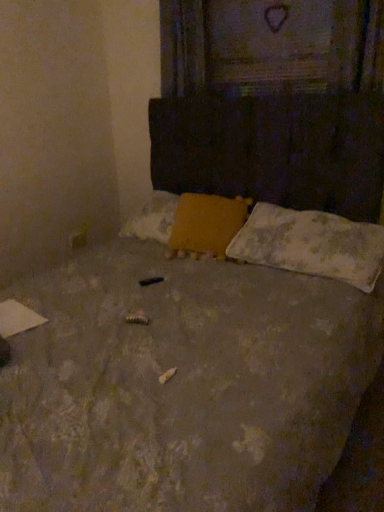
What do you see at coordinates (271, 45) in the screenshot?
I see `wooden textured frame at upper center` at bounding box center [271, 45].

Identify the location of yellow fabric pillow at center, which is counted as the second pillow, starting from the right. (206, 225).

How distant is wooden textured frame at upper center from yellow fabric pillow at center, acting as the 1th pillow starting from the left?

They are 39.28 inches apart.

Which object is closer to the camera taking this photo, wooden textured frame at upper center or yellow fabric pillow at center, acting as the 1th pillow starting from the left?

yellow fabric pillow at center, acting as the 1th pillow starting from the left.

In the scene shown: Does wooden textured frame at upper center touch yellow fabric pillow at center, acting as the 1th pillow starting from the left?

No, wooden textured frame at upper center is not beside yellow fabric pillow at center, acting as the 1th pillow starting from the left.

Which is more to the left, wooden textured frame at upper center or yellow fabric pillow at center, which is counted as the second pillow, starting from the right?

yellow fabric pillow at center, which is counted as the second pillow, starting from the right, is more to the left.

Measure the distance between white textured pillow at lower right, which ranks as the second pillow in left-to-right order, and yellow fabric pillow at center, acting as the 1th pillow starting from the left.

white textured pillow at lower right, which ranks as the second pillow in left-to-right order, and yellow fabric pillow at center, acting as the 1th pillow starting from the left, are 11.08 inches apart.

How different are the orientations of white textured pillow at lower right, which ranks as the second pillow in left-to-right order, and yellow fabric pillow at center, acting as the 1th pillow starting from the left, in degrees?

18.1 degrees.

Is white textured pillow at lower right, which ranks as the second pillow in left-to-right order, thinner than yellow fabric pillow at center, acting as the 1th pillow starting from the left?

Incorrect, the width of white textured pillow at lower right, which ranks as the second pillow in left-to-right order, is not less than that of yellow fabric pillow at center, acting as the 1th pillow starting from the left.

From the picture: Which of these two, white textured pillow at lower right, which ranks as the second pillow in left-to-right order, or yellow fabric pillow at center, acting as the 1th pillow starting from the left, is smaller?

yellow fabric pillow at center, acting as the 1th pillow starting from the left.

In the image, is wooden textured frame at upper center on the left side or the right side of white textured pillow at lower right, which ranks as the second pillow in left-to-right order?

Based on their positions, wooden textured frame at upper center is located to the left of white textured pillow at lower right, which ranks as the second pillow in left-to-right order.

Is wooden textured frame at upper center inside or outside of white textured pillow at lower right, the first pillow in the right-to-left sequence?

wooden textured frame at upper center lies outside white textured pillow at lower right, the first pillow in the right-to-left sequence.

Does point (251, 89) come closer to viewer compared to point (277, 250)?

No, it is behind (277, 250).

Considering their positions, is yellow fabric pillow at center, acting as the 1th pillow starting from the left, located in front of or behind wooden textured frame at upper center?

Clearly, yellow fabric pillow at center, acting as the 1th pillow starting from the left, is in front of wooden textured frame at upper center.

Is yellow fabric pillow at center, acting as the 1th pillow starting from the left, thinner than wooden textured frame at upper center?

No.

Between yellow fabric pillow at center, acting as the 1th pillow starting from the left, and wooden textured frame at upper center, which one has more height?

wooden textured frame at upper center.

From the image's perspective, which object appears higher, yellow fabric pillow at center, acting as the 1th pillow starting from the left, or white textured pillow at lower right, which ranks as the second pillow in left-to-right order?

yellow fabric pillow at center, acting as the 1th pillow starting from the left, is shown above in the image.

I want to click on pillow that appears below the yellow fabric pillow at center, acting as the 1th pillow starting from the left (from a real-world perspective), so click(x=311, y=244).

Based on their positions, is yellow fabric pillow at center, which is counted as the second pillow, starting from the right, located to the left or right of white textured pillow at lower right, which ranks as the second pillow in left-to-right order?

In the image, yellow fabric pillow at center, which is counted as the second pillow, starting from the right, appears on the left side of white textured pillow at lower right, which ranks as the second pillow in left-to-right order.

Which is behind, point (196, 234) or point (277, 251)?

Positioned behind is point (196, 234).

Which of these two, white textured pillow at lower right, which ranks as the second pillow in left-to-right order, or wooden textured frame at upper center, is wider?

white textured pillow at lower right, which ranks as the second pillow in left-to-right order.

How different are the orientations of white textured pillow at lower right, which ranks as the second pillow in left-to-right order, and wooden textured frame at upper center in degrees?

1.68 degrees.

Which of these two, white textured pillow at lower right, the first pillow in the right-to-left sequence, or wooden textured frame at upper center, stands shorter?

With less height is white textured pillow at lower right, the first pillow in the right-to-left sequence.

Could you measure the distance between white textured pillow at lower right, which ranks as the second pillow in left-to-right order, and wooden textured frame at upper center?

white textured pillow at lower right, which ranks as the second pillow in left-to-right order, is 96.86 centimeters from wooden textured frame at upper center.

The height and width of the screenshot is (512, 384). In order to click on window frame above the yellow fabric pillow at center, acting as the 1th pillow starting from the left (from a real-world perspective) in this screenshot , I will do `click(271, 45)`.

Locate an element on the screen. pillow below the yellow fabric pillow at center, acting as the 1th pillow starting from the left (from the image's perspective) is located at coordinates (311, 244).

When comparing their distances from yellow fabric pillow at center, acting as the 1th pillow starting from the left, does white textured pillow at lower right, the first pillow in the right-to-left sequence, or wooden textured frame at upper center seem further?

Among the two, wooden textured frame at upper center is located further to yellow fabric pillow at center, acting as the 1th pillow starting from the left.

Considering their positions, is wooden textured frame at upper center positioned closer to white textured pillow at lower right, the first pillow in the right-to-left sequence, than yellow fabric pillow at center, which is counted as the second pillow, starting from the right?

Among the two, yellow fabric pillow at center, which is counted as the second pillow, starting from the right, is located nearer to white textured pillow at lower right, the first pillow in the right-to-left sequence.

Which object lies nearer to the anchor point wooden textured frame at upper center, white textured pillow at lower right, the first pillow in the right-to-left sequence, or yellow fabric pillow at center, acting as the 1th pillow starting from the left?

white textured pillow at lower right, the first pillow in the right-to-left sequence, is closer to wooden textured frame at upper center.

When comparing their distances from yellow fabric pillow at center, which is counted as the second pillow, starting from the right, does wooden textured frame at upper center or white textured pillow at lower right, which ranks as the second pillow in left-to-right order, seem closer?

white textured pillow at lower right, which ranks as the second pillow in left-to-right order, is closer to yellow fabric pillow at center, which is counted as the second pillow, starting from the right.

Based on their spatial positions, is yellow fabric pillow at center, which is counted as the second pillow, starting from the right, or wooden textured frame at upper center further from white textured pillow at lower right, which ranks as the second pillow in left-to-right order?

wooden textured frame at upper center lies further to white textured pillow at lower right, which ranks as the second pillow in left-to-right order, than the other object.

Estimate the real-world distances between objects in this image. Which object is closer to wooden textured frame at upper center, yellow fabric pillow at center, which is counted as the second pillow, starting from the right, or white textured pillow at lower right, which ranks as the second pillow in left-to-right order?

white textured pillow at lower right, which ranks as the second pillow in left-to-right order, lies closer to wooden textured frame at upper center than the other object.

This screenshot has height=512, width=384. Identify the location of pillow between wooden textured frame at upper center and white textured pillow at lower right, the first pillow in the right-to-left sequence, vertically. (206, 225).